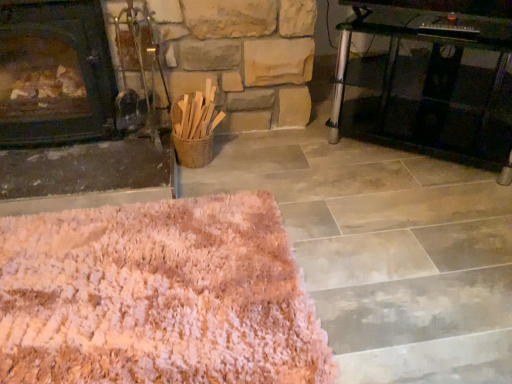
Question: From a real-world perspective, is transparent glass table at right located higher than pink shaggy rug at lower left?

Choices:
 (A) yes
 (B) no

Answer: (A)

Question: From a real-world perspective, does transparent glass table at right sit lower than pink shaggy rug at lower left?

Choices:
 (A) no
 (B) yes

Answer: (A)

Question: Is transparent glass table at right looking in the opposite direction of pink shaggy rug at lower left?

Choices:
 (A) yes
 (B) no

Answer: (B)

Question: Does transparent glass table at right contain pink shaggy rug at lower left?

Choices:
 (A) yes
 (B) no

Answer: (B)

Question: From the image's perspective, is transparent glass table at right on pink shaggy rug at lower left?

Choices:
 (A) yes
 (B) no

Answer: (A)

Question: Considering the relative sizes of transparent glass table at right and pink shaggy rug at lower left in the image provided, is transparent glass table at right smaller than pink shaggy rug at lower left?

Choices:
 (A) yes
 (B) no

Answer: (B)

Question: From a real-world perspective, is pink shaggy rug at lower left below transparent glass table at right?

Choices:
 (A) yes
 (B) no

Answer: (A)

Question: Is transparent glass table at right completely or partially inside pink shaggy rug at lower left?

Choices:
 (A) no
 (B) yes

Answer: (A)

Question: Is pink shaggy rug at lower left smaller than transparent glass table at right?

Choices:
 (A) no
 (B) yes

Answer: (B)

Question: Is pink shaggy rug at lower left turned away from transparent glass table at right?

Choices:
 (A) yes
 (B) no

Answer: (B)

Question: Is pink shaggy rug at lower left positioned far away from transparent glass table at right?

Choices:
 (A) yes
 (B) no

Answer: (A)

Question: From the image's perspective, would you say pink shaggy rug at lower left is positioned over transparent glass table at right?

Choices:
 (A) yes
 (B) no

Answer: (B)

Question: Is pink shaggy rug at lower left aimed at dark wood fireplace at left?

Choices:
 (A) no
 (B) yes

Answer: (A)